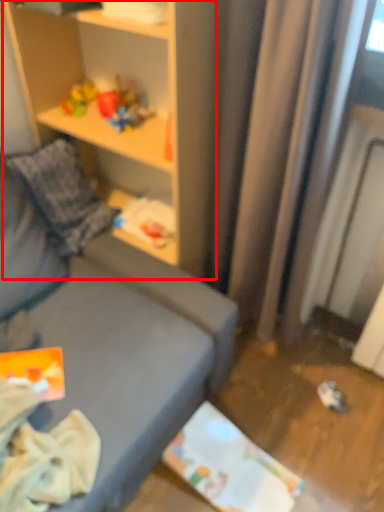
Question: In this image, where is shelf (annotated by the red box) located relative to toy?

Choices:
 (A) right
 (B) left

Answer: (A)